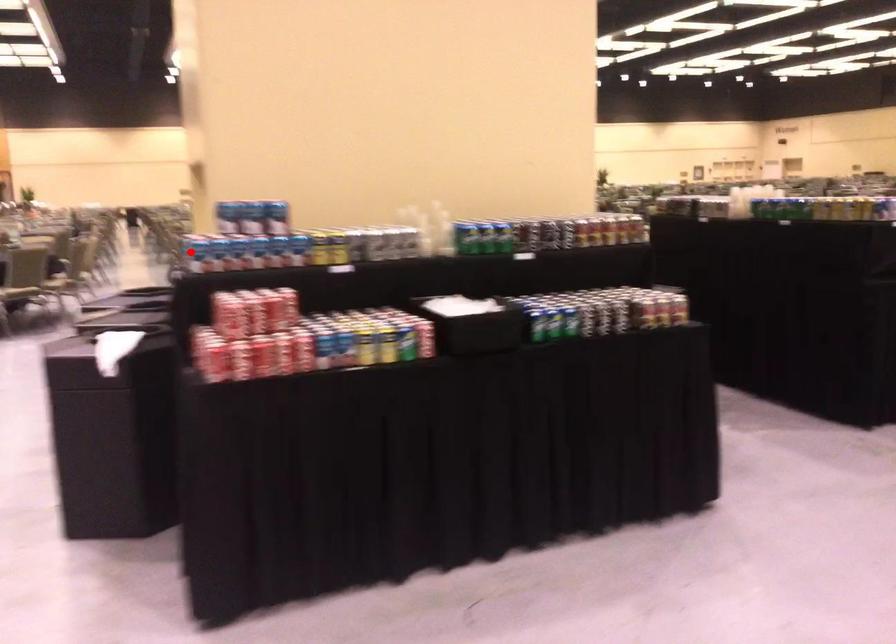
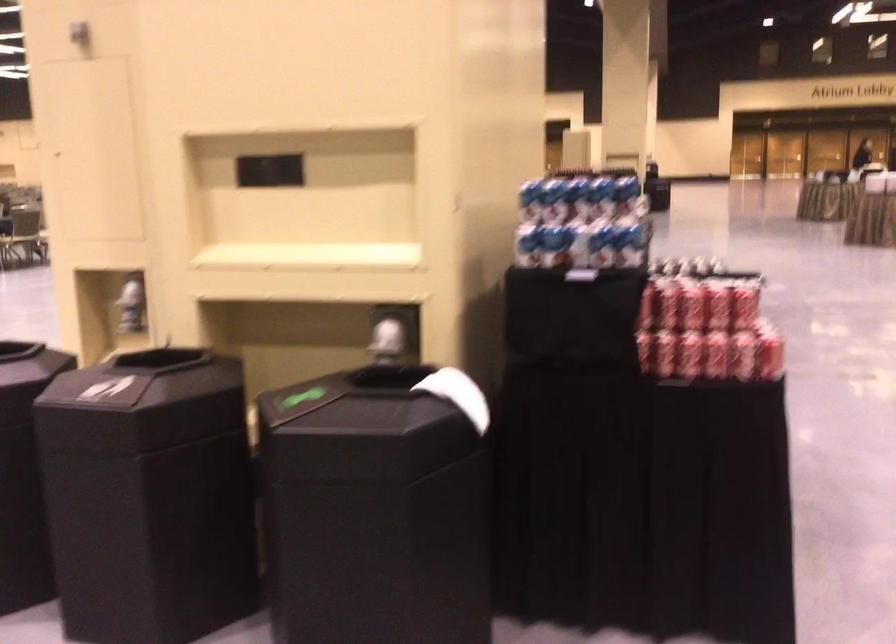
In the second image, find the point that corresponds to the highlighted location in the first image.

(600, 245)